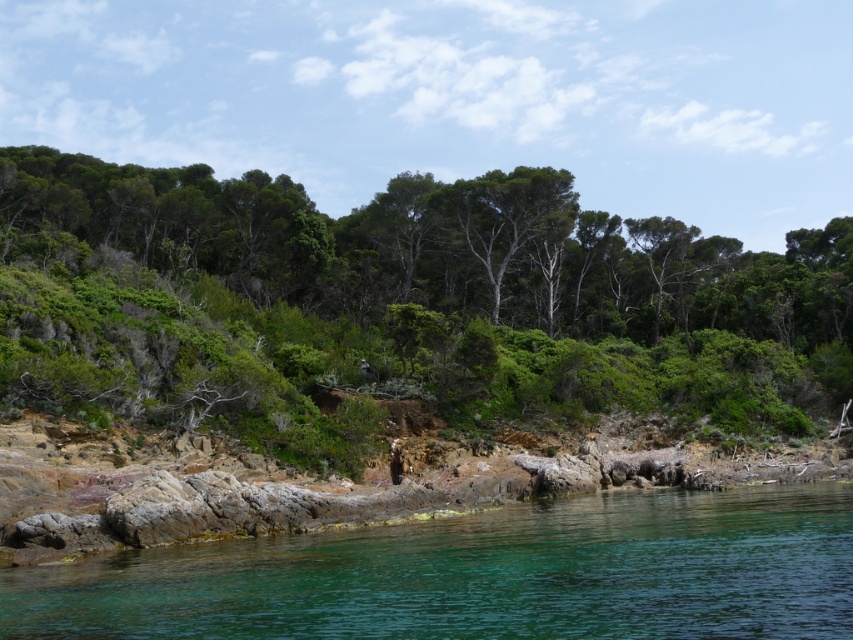
Question: Which point is farther to the camera?

Choices:
 (A) clear water at lower left
 (B) green leafy trees at center

Answer: (B)

Question: Which point appears closest to the camera in this image?

Choices:
 (A) (805, 632)
 (B) (428, 396)

Answer: (A)

Question: Does green leafy trees at center have a smaller size compared to clear water at lower left?

Choices:
 (A) yes
 (B) no

Answer: (B)

Question: Can you confirm if green leafy trees at center is positioned to the left of clear water at lower left?

Choices:
 (A) yes
 (B) no

Answer: (B)

Question: Does green leafy trees at center appear under clear water at lower left?

Choices:
 (A) yes
 (B) no

Answer: (B)